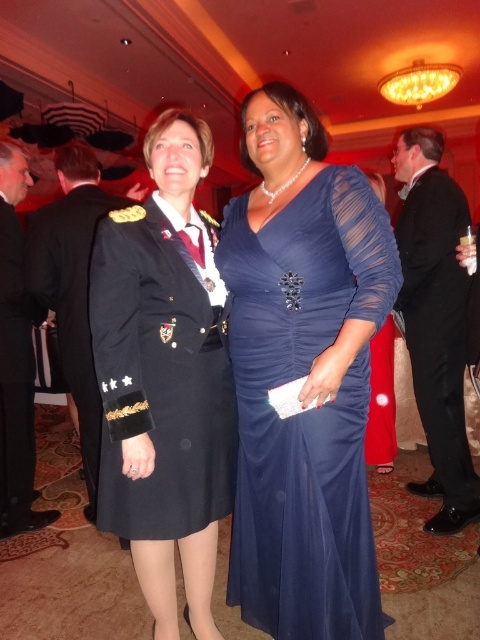
Question: Does navy blue fabric uniform at left come in front of dark blue uniform at center?

Choices:
 (A) no
 (B) yes

Answer: (B)

Question: Considering the real-world distances, which object is farthest from the black uniform at left?

Choices:
 (A) dark blue uniform at center
 (B) black satin suit at right
 (C) navy blue fabric uniform at left

Answer: (B)

Question: Is black satin suit at right wider than black uniform at left?

Choices:
 (A) no
 (B) yes

Answer: (B)

Question: Is navy blue fabric uniform at left positioned at the back of black uniform at left?

Choices:
 (A) yes
 (B) no

Answer: (B)

Question: Among these points, which one is farthest from the camera?

Choices:
 (A) (330, 593)
 (B) (427, 321)
 (C) (93, 429)

Answer: (C)

Question: Which point is farther to the camera?

Choices:
 (A) (463, 509)
 (B) (301, 365)

Answer: (A)